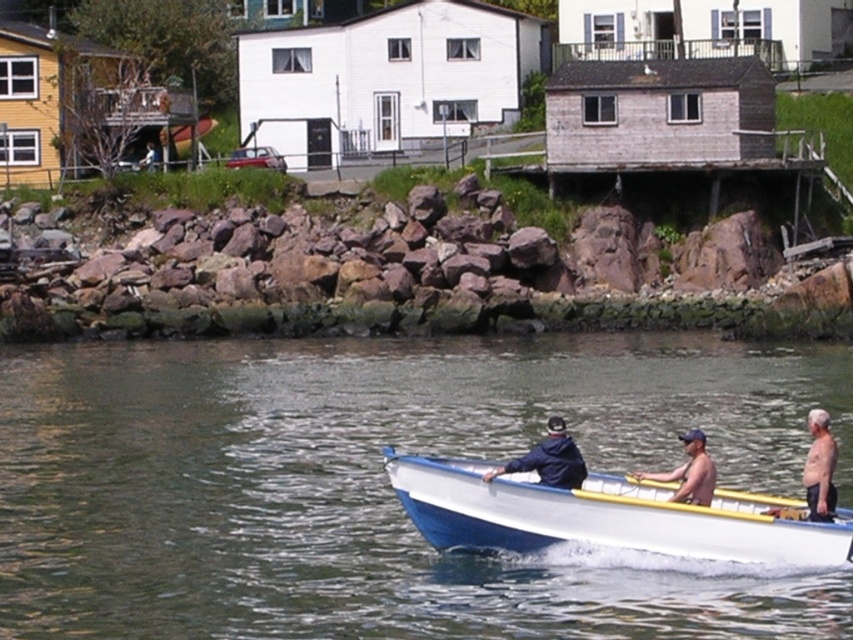
Which is above, light blue wood boat at center or tan skin man at lower center?

Positioned higher is light blue wood boat at center.

Locate an element on the screen. light blue wood boat at center is located at coordinates (820, 468).

Measure the distance from dark blue jacket at center to skinny tan man at right.

dark blue jacket at center is 3.52 meters from skinny tan man at right.

Is dark blue jacket at center thinner than skinny tan man at right?

Yes.

This screenshot has width=853, height=640. I want to click on dark blue jacket at center, so [549, 460].

This screenshot has width=853, height=640. What are the coordinates of `light blue wood boat at center` in the screenshot? It's located at (820, 468).

Identify the location of light blue wood boat at center. (820, 468).